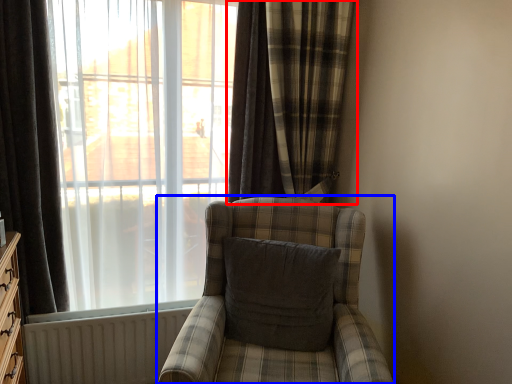
Question: Among these objects, which one is nearest to the camera, curtain (highlighted by a red box) or chair (highlighted by a blue box)?

Choices:
 (A) curtain
 (B) chair

Answer: (B)